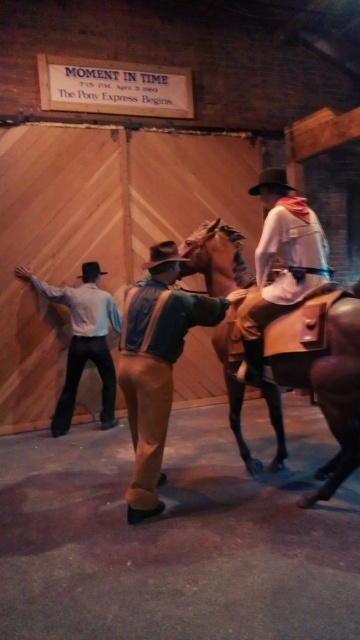
Question: Does brown leather horse at center appear on the left side of denim jacket at center?

Choices:
 (A) no
 (B) yes

Answer: (A)

Question: Which object is positioned farthest from the light blue shirt at left?

Choices:
 (A) denim jacket at center
 (B) brown leather horse at center
 (C) leather jacket at center

Answer: (B)

Question: Is brown leather horse at center smaller than denim jacket at center?

Choices:
 (A) yes
 (B) no

Answer: (A)

Question: Is brown leather horse at center bigger than light blue shirt at left?

Choices:
 (A) no
 (B) yes

Answer: (A)

Question: Which object is farther from the camera taking this photo?

Choices:
 (A) brown leather horse at center
 (B) light blue shirt at left
 (C) leather jacket at center

Answer: (B)

Question: Which object appears farthest from the camera in this image?

Choices:
 (A) leather jacket at center
 (B) brown leather horse at center

Answer: (A)